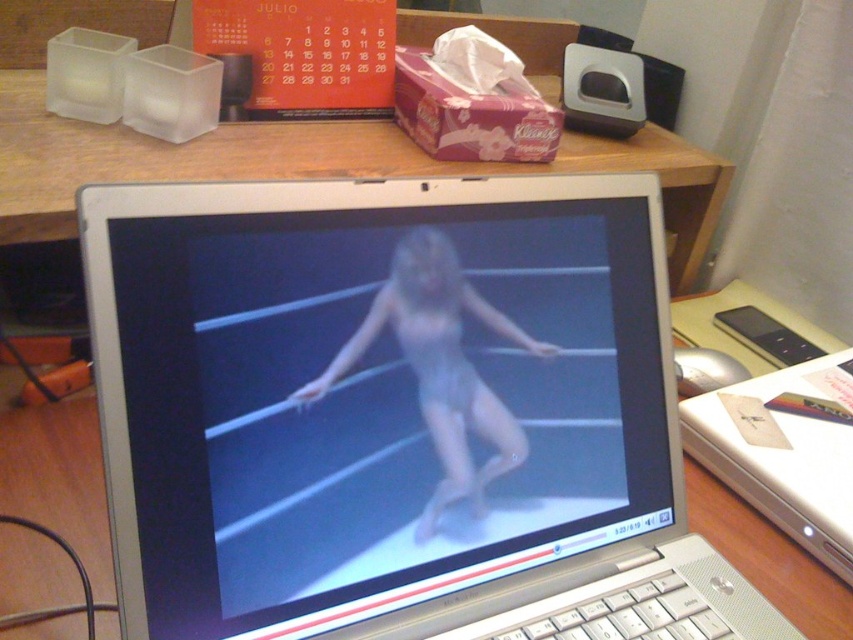
Looking at this image, what are the coordinates of the silver metallic laptop at center?

The silver metallic laptop at center is located at coordinates point (396, 413).

You are sitting at the desk and want to reach for the object at point (434, 296). Is it closer to you or further away compared to the object at point (415, 374)?

Point (434, 296) is behind point (415, 374), so it is further away from you compared to the object at point (415, 374).

You are organizing the desk items and want to place the white plastic mouse at right closer to the silver metallic laptop at center. Which direction should you move the mouse?

The silver metallic laptop at center is to the left of the white plastic mouse at right, so to move the mouse closer to the laptop, you should move it to the left.